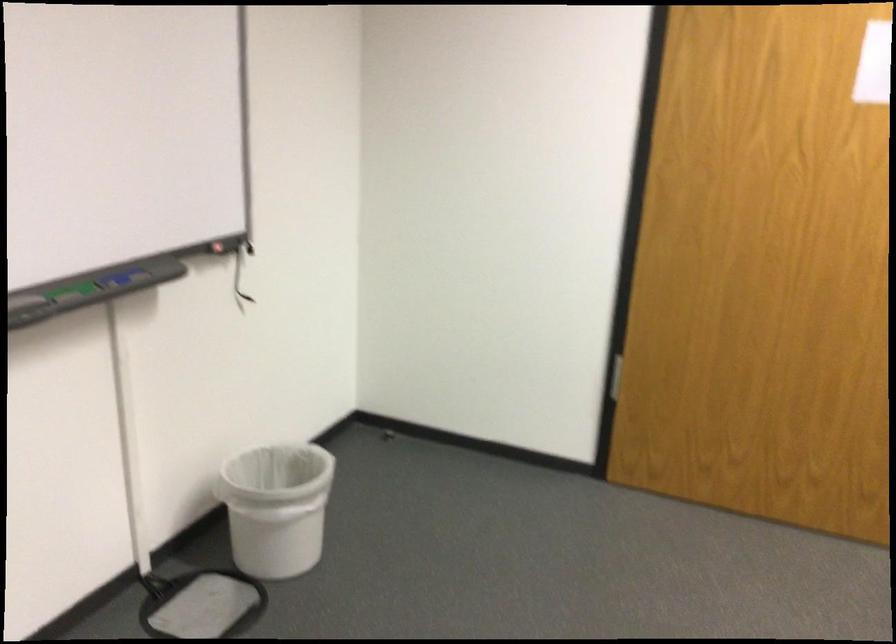
What do you see at coordinates (277, 507) in the screenshot? I see `the white trash can` at bounding box center [277, 507].